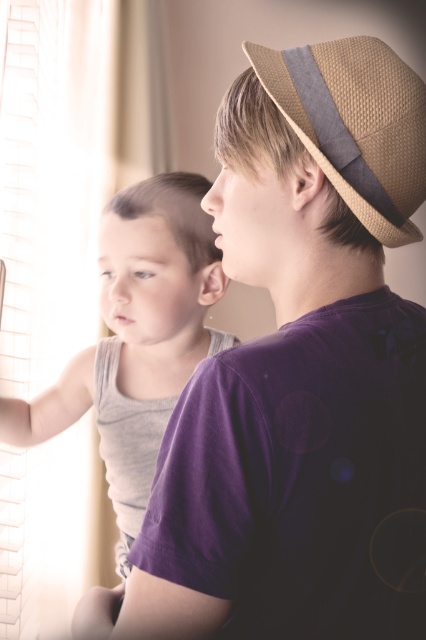
Question: Which object appears closest to the camera in this image?

Choices:
 (A) gray cotton tank top at left
 (B) braided straw hat at upper right

Answer: (B)

Question: Where is gray cotton tank top at left located in relation to braided straw hat at upper right in the image?

Choices:
 (A) left
 (B) right

Answer: (A)

Question: Which object is farther from the camera taking this photo?

Choices:
 (A) gray cotton tank top at left
 (B) purple cotton shirt at upper right
 (C) braided straw hat at upper right

Answer: (A)

Question: Which of the following is the closest to the observer?

Choices:
 (A) (209, 332)
 (B) (331, 60)

Answer: (B)

Question: Is gray cotton tank top at left wider than braided straw hat at upper right?

Choices:
 (A) no
 (B) yes

Answer: (B)

Question: Does purple cotton shirt at upper right appear under braided straw hat at upper right?

Choices:
 (A) no
 (B) yes

Answer: (B)